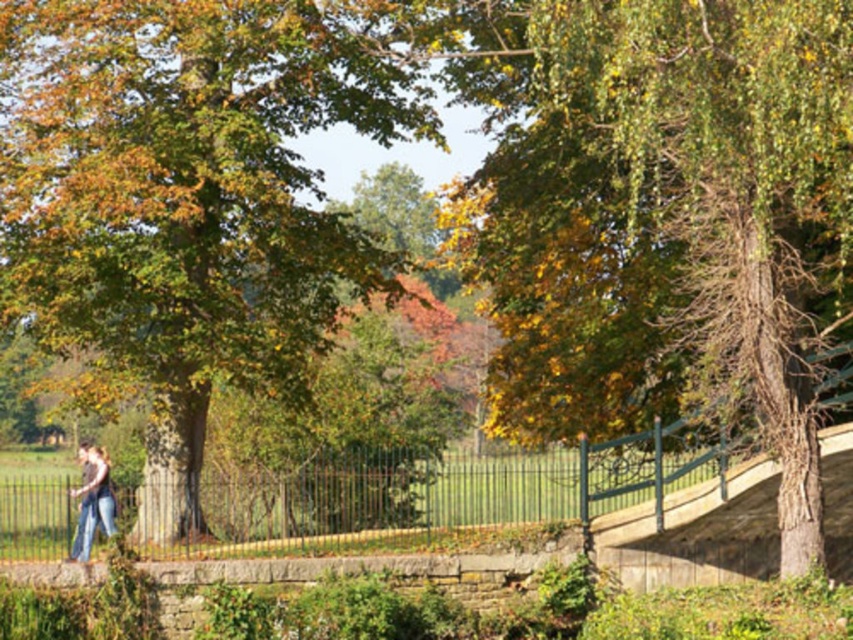
Question: Which of the following is the closest to the observer?

Choices:
 (A) (260, 19)
 (B) (498, 192)

Answer: (A)

Question: Can you confirm if green leafy tree at upper right is positioned below green leafy tree at left?

Choices:
 (A) no
 (B) yes

Answer: (B)

Question: Is green leafy tree at upper right wider than green leafy tree at left?

Choices:
 (A) no
 (B) yes

Answer: (A)

Question: Is green leafy tree at upper right bigger than green leafy tree at left?

Choices:
 (A) yes
 (B) no

Answer: (B)

Question: Which point is closer to the camera taking this photo?

Choices:
 (A) (724, 19)
 (B) (161, 216)

Answer: (A)